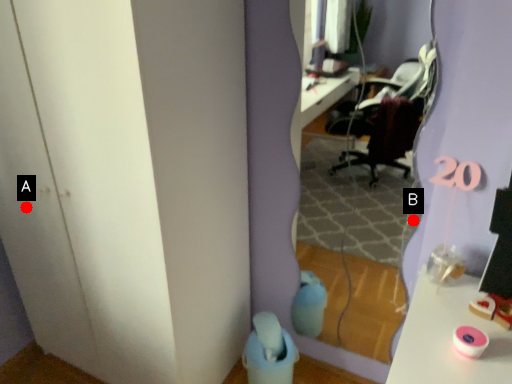
Question: Two points are circled on the image, labeled by A and B beside each circle. Which point is closer to the camera?

Choices:
 (A) A is closer
 (B) B is closer

Answer: (A)